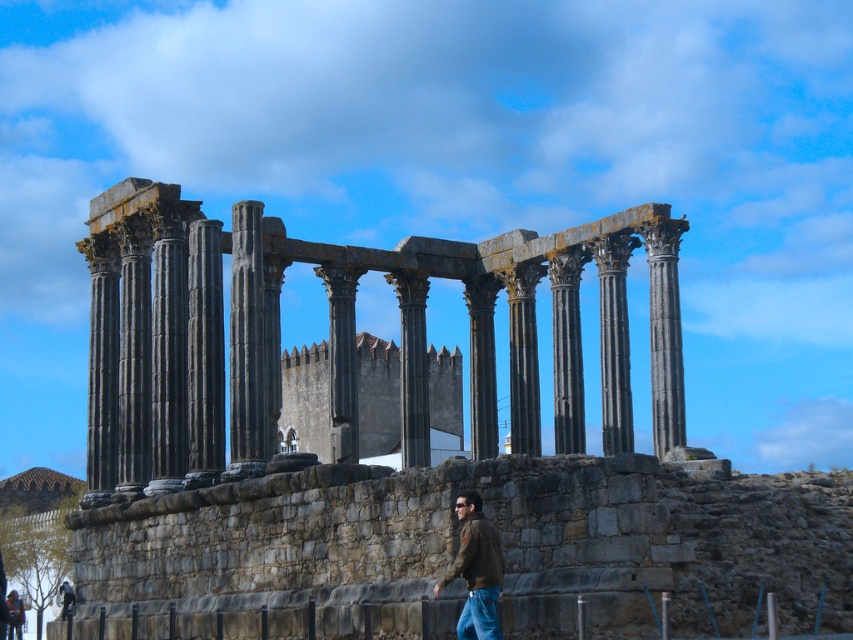
You are standing in front of the ancient Roman temple ruin. You see a black stone column at center and a brown leather jacket at lower right. Which object is closer to you?

The brown leather jacket at lower right is behind the black stone column at center, so the black stone column at center is closer to you.

You are standing at the low stone wall in front of the ancient Roman temple ruin. You see two points marked in the image. Which point is closer to you, point (663,374) or point (486,552)?

Point (486,552) is closer to you because it is less further to the camera than point (663,374).